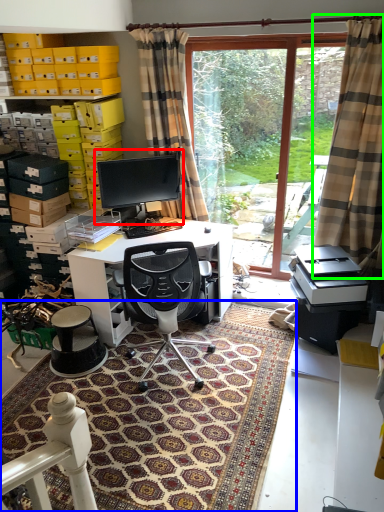
Question: Considering the real-world distances, which object is closest to computer monitor (highlighted by a red box)? mat (highlighted by a blue box) or curtain (highlighted by a green box).

Choices:
 (A) mat
 (B) curtain

Answer: (B)